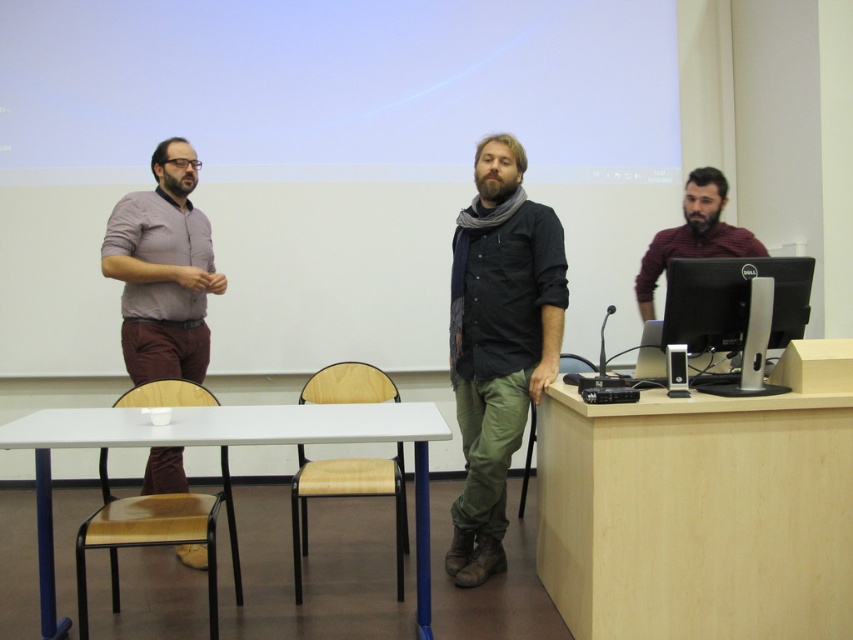
Can you confirm if white matte projection screen at upper center is wider than black glossy monitor at right?

Correct, the width of white matte projection screen at upper center exceeds that of black glossy monitor at right.

Who is more distant from viewer, [618,86] or [775,259]?

The point [618,86] is behind.

Locate an element on the screen. white matte projection screen at upper center is located at coordinates [337, 86].

The height and width of the screenshot is (640, 853). I want to click on white matte projection screen at upper center, so click(337, 86).

Who is taller, black glossy monitor at right or light brown fabric chair at center?

With more height is light brown fabric chair at center.

Locate an element on the screen. The width and height of the screenshot is (853, 640). black glossy monitor at right is located at coordinates (732, 300).

Between point (738, 323) and point (335, 364), which one is positioned behind?

Positioned behind is point (335, 364).

The image size is (853, 640). I want to click on black glossy monitor at right, so click(732, 300).

You are a GUI agent. You are given a task and a screenshot of the screen. Output one action in this format:
    pyautogui.click(x=<x>, y=<y>)
    Task: Click on the white plastic table at center
    This screenshot has height=640, width=853.
    Given the screenshot: What is the action you would take?
    pyautogui.click(x=225, y=444)

Where is `white plastic table at center`? This screenshot has width=853, height=640. white plastic table at center is located at coordinates (225, 444).